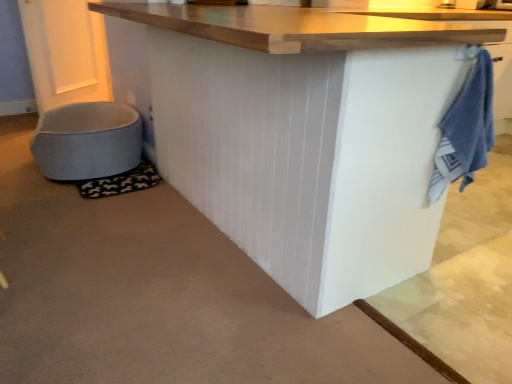
Question: From a real-world perspective, does white matte table at center stand above blue terry cloth towel at right?

Choices:
 (A) no
 (B) yes

Answer: (A)

Question: Is white matte table at center facing away from blue terry cloth towel at right?

Choices:
 (A) yes
 (B) no

Answer: (B)

Question: Does white matte table at center have a lesser width compared to blue terry cloth towel at right?

Choices:
 (A) no
 (B) yes

Answer: (A)

Question: Can you confirm if white matte table at center is wider than blue terry cloth towel at right?

Choices:
 (A) yes
 (B) no

Answer: (A)

Question: Does white matte table at center come in front of blue terry cloth towel at right?

Choices:
 (A) no
 (B) yes

Answer: (B)

Question: Can you confirm if white matte table at center is smaller than blue terry cloth towel at right?

Choices:
 (A) yes
 (B) no

Answer: (B)

Question: Would you say blue terry cloth towel at right contains light blue fabric pet bed at lower left?

Choices:
 (A) yes
 (B) no

Answer: (B)

Question: Is blue terry cloth towel at right taller than light blue fabric pet bed at lower left?

Choices:
 (A) yes
 (B) no

Answer: (A)

Question: Does blue terry cloth towel at right turn towards light blue fabric pet bed at lower left?

Choices:
 (A) no
 (B) yes

Answer: (A)

Question: Is blue terry cloth towel at right outside light blue fabric pet bed at lower left?

Choices:
 (A) no
 (B) yes

Answer: (B)

Question: Is light blue fabric pet bed at lower left at the back of blue terry cloth towel at right?

Choices:
 (A) no
 (B) yes

Answer: (A)

Question: Is blue terry cloth towel at right bigger than light blue fabric pet bed at lower left?

Choices:
 (A) no
 (B) yes

Answer: (A)

Question: Does light blue fabric pet bed at lower left appear on the right side of white matte table at center?

Choices:
 (A) yes
 (B) no

Answer: (B)